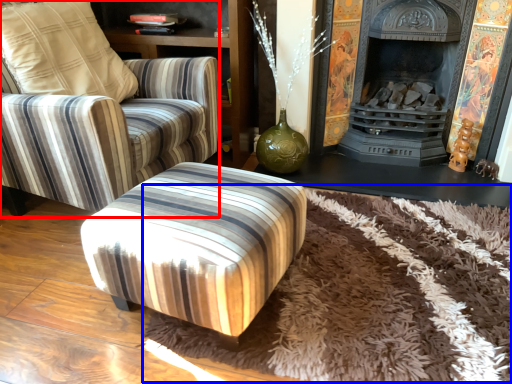
Question: Which of the following is the closest to the observer, chair (highlighted by a red box) or mat (highlighted by a blue box)?

Choices:
 (A) chair
 (B) mat

Answer: (B)